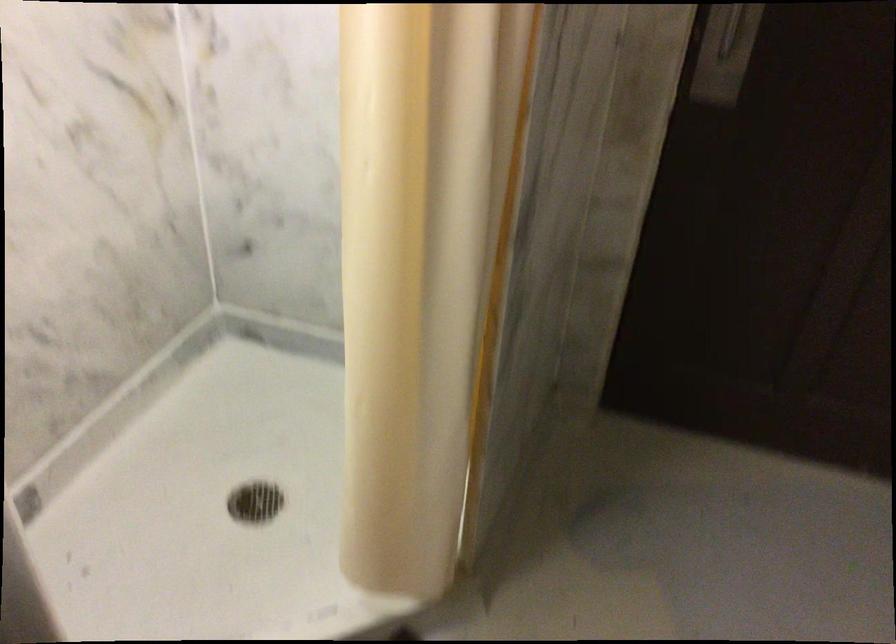
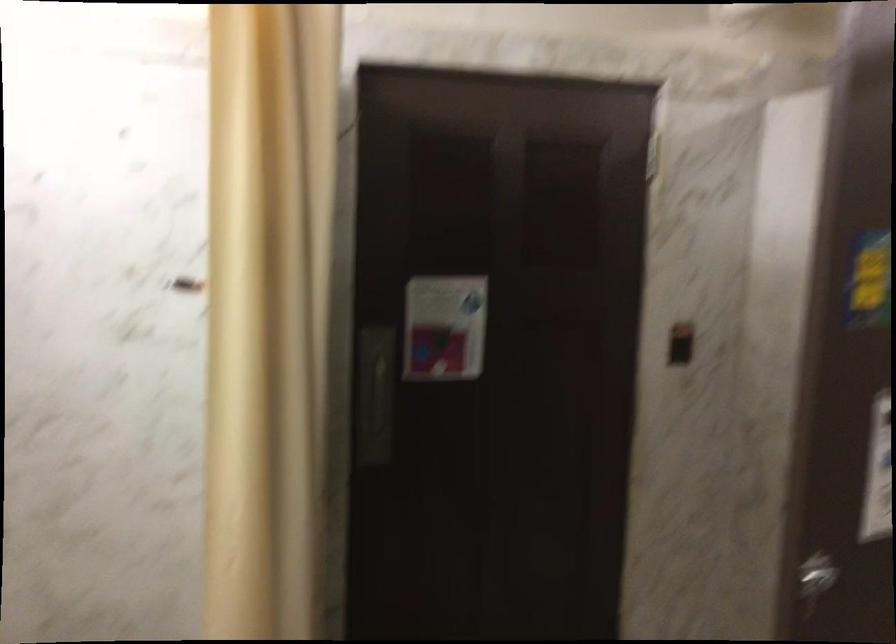
First-person continuous shooting, in which direction is the camera rotating?

The camera's rotation is toward right-up.